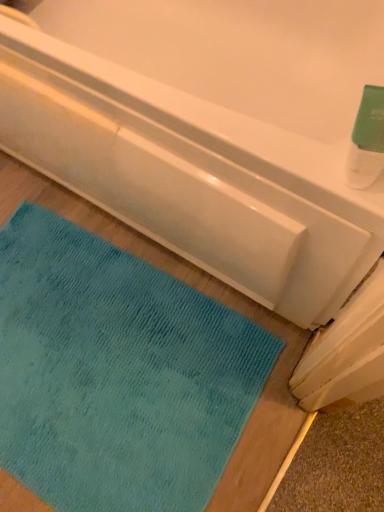
Question: Should I look upward or downward to see teal plush mat at lower left?

Choices:
 (A) up
 (B) down

Answer: (B)

Question: Does teal plush mat at lower left have a lesser width compared to matte white bathtub at upper center?

Choices:
 (A) yes
 (B) no

Answer: (A)

Question: Is teal plush mat at lower left facing away from matte white bathtub at upper center?

Choices:
 (A) no
 (B) yes

Answer: (B)

Question: Is teal plush mat at lower left positioned far away from matte white bathtub at upper center?

Choices:
 (A) yes
 (B) no

Answer: (B)

Question: Can you confirm if teal plush mat at lower left is positioned to the left of matte white bathtub at upper center?

Choices:
 (A) no
 (B) yes

Answer: (A)

Question: Considering the relative sizes of teal plush mat at lower left and matte white bathtub at upper center in the image provided, is teal plush mat at lower left smaller than matte white bathtub at upper center?

Choices:
 (A) yes
 (B) no

Answer: (A)

Question: Is teal plush mat at lower left next to matte white bathtub at upper center and touching it?

Choices:
 (A) yes
 (B) no

Answer: (B)

Question: From a real-world perspective, is green matte bottle at upper right located higher than teal plush mat at lower left?

Choices:
 (A) no
 (B) yes

Answer: (B)

Question: Is green matte bottle at upper right positioned in front of teal plush mat at lower left?

Choices:
 (A) yes
 (B) no

Answer: (A)

Question: Is green matte bottle at upper right bigger than teal plush mat at lower left?

Choices:
 (A) no
 (B) yes

Answer: (A)

Question: Considering the relative sizes of green matte bottle at upper right and teal plush mat at lower left in the image provided, is green matte bottle at upper right thinner than teal plush mat at lower left?

Choices:
 (A) yes
 (B) no

Answer: (A)

Question: Considering the relative sizes of green matte bottle at upper right and teal plush mat at lower left in the image provided, is green matte bottle at upper right taller than teal plush mat at lower left?

Choices:
 (A) yes
 (B) no

Answer: (A)

Question: Is green matte bottle at upper right aimed at teal plush mat at lower left?

Choices:
 (A) no
 (B) yes

Answer: (A)

Question: From the image's perspective, is matte white bathtub at upper center located above green matte bottle at upper right?

Choices:
 (A) yes
 (B) no

Answer: (B)